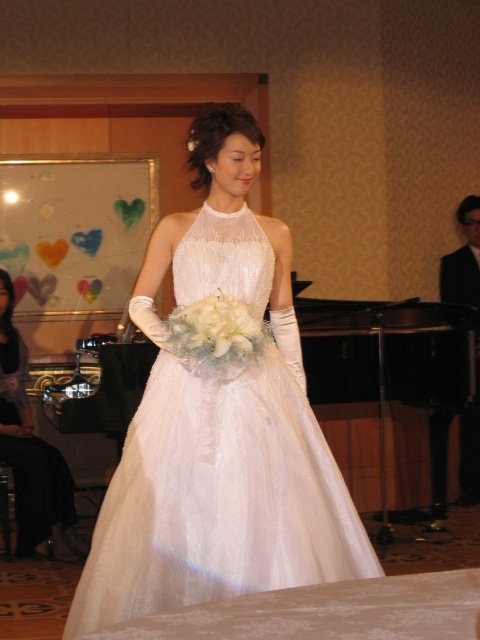
Question: Which object is closer to the camera taking this photo?

Choices:
 (A) matte white dress at center
 (B) white silk bouquet at center
 (C) white satin dress at center

Answer: (C)

Question: Does matte white dress at center have a smaller size compared to white silk bouquet at center?

Choices:
 (A) yes
 (B) no

Answer: (B)

Question: Can you confirm if matte white dress at center is positioned to the right of white silk bouquet at center?

Choices:
 (A) no
 (B) yes

Answer: (A)

Question: Which object appears farthest from the camera in this image?

Choices:
 (A) matte white dress at center
 (B) white silk bouquet at center

Answer: (A)

Question: Does matte white dress at center have a larger size compared to white silk bouquet at center?

Choices:
 (A) yes
 (B) no

Answer: (A)

Question: Which point is closer to the camera?

Choices:
 (A) (288, 483)
 (B) (66, 490)

Answer: (A)